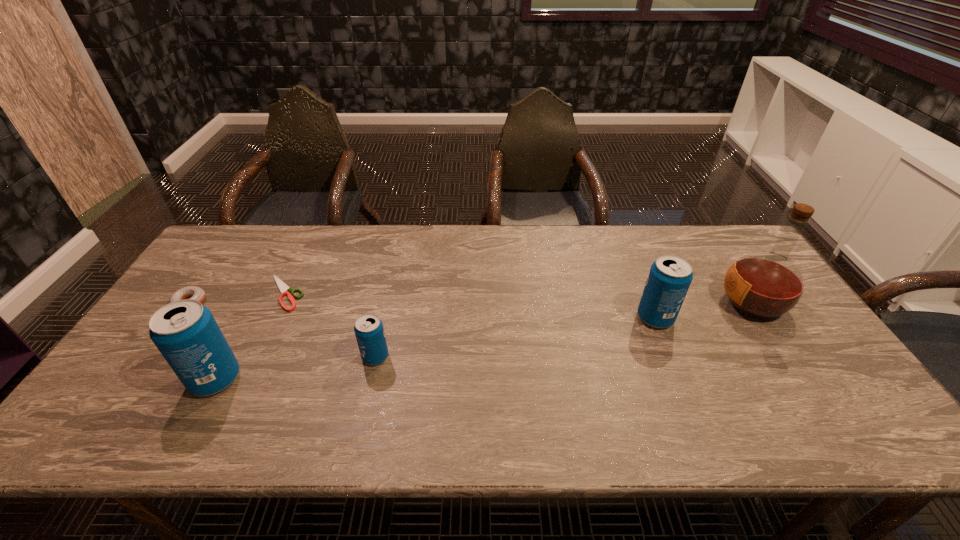
Find the location of a particular element. This screenshot has height=540, width=960. vacant spot for a new pop_(soda) to ensure equal spacing is located at coordinates (521, 336).